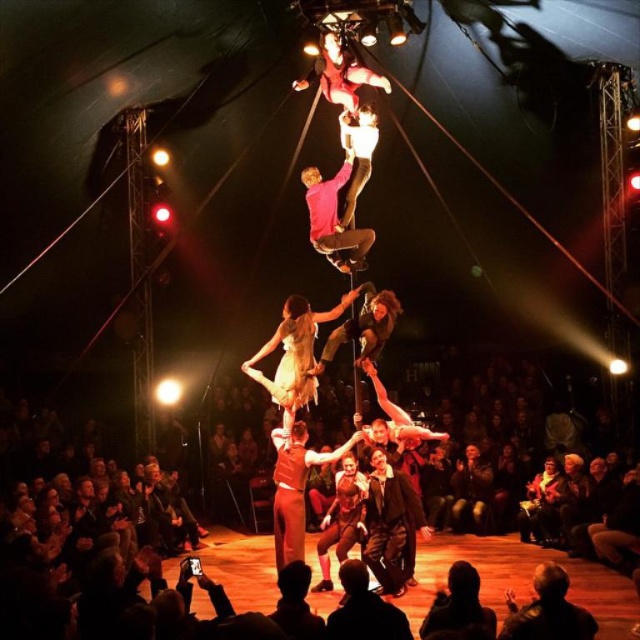
You are a photographer trying to capture the entire pyramid formation in one shot. You notice two elements in the foreground, the dark clothing audience at lower center and dark hair at lower center. Which of these elements has a larger width in the image?

The dark clothing audience at lower center might be wider than dark hair at lower center according to the description provided.

You are a photographer positioned at the front of the circus tent. You want to capture a photo of the dark clothing audience at lower center and the leather jacket at lower right in the same frame. Which direction should you move to ensure both are visible?

The dark clothing audience at lower center is to the left of the leather jacket at lower right, so you should move to the right to ensure both are visible in the frame.

You are an observer watching the acrobatic performance in the circus tent. You notice two points marked in the image. The first point is at coordinates point (556,602) and the second point is at point (433,609). From your viewpoint, which point is closer to you?

Point (556,602) is in front of point (433,609), so it is closer to you.